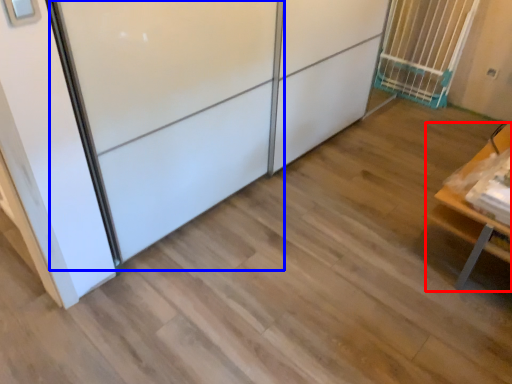
Question: Which point is closer to the camera, furniture (highlighted by a red box) or screen door (highlighted by a blue box)?

Choices:
 (A) furniture
 (B) screen door

Answer: (B)